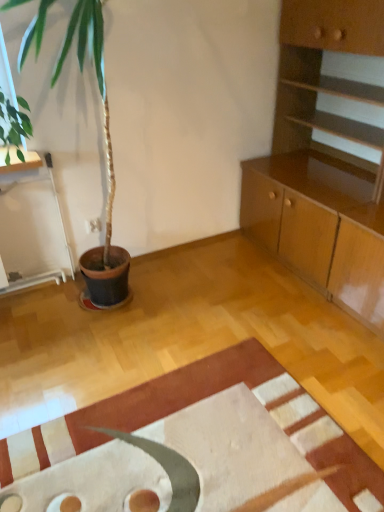
Question: Is textured beige rug at center inside or outside of light brown wood cabinet at upper right?

Choices:
 (A) inside
 (B) outside

Answer: (B)

Question: From a real-world perspective, is textured beige rug at center physically located above or below light brown wood cabinet at upper right?

Choices:
 (A) above
 (B) below

Answer: (B)

Question: Considering the positions of textured beige rug at center and light brown wood cabinet at upper right in the image, is textured beige rug at center wider or thinner than light brown wood cabinet at upper right?

Choices:
 (A) thin
 (B) wide

Answer: (B)

Question: Visually, is light brown wood cabinet at upper right positioned to the left or to the right of textured beige rug at center?

Choices:
 (A) right
 (B) left

Answer: (A)

Question: Considering the positions of light brown wood cabinet at upper right and textured beige rug at center in the image, is light brown wood cabinet at upper right bigger or smaller than textured beige rug at center?

Choices:
 (A) small
 (B) big

Answer: (B)

Question: Would you say light brown wood cabinet at upper right is inside or outside textured beige rug at center?

Choices:
 (A) outside
 (B) inside

Answer: (A)

Question: From their relative heights in the image, would you say light brown wood cabinet at upper right is taller or shorter than textured beige rug at center?

Choices:
 (A) tall
 (B) short

Answer: (A)